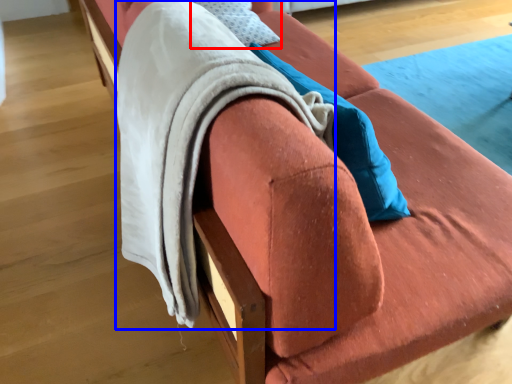
Question: Which object appears closest to the camera in this image, pillow (highlighted by a red box) or blanket (highlighted by a blue box)?

Choices:
 (A) pillow
 (B) blanket

Answer: (B)